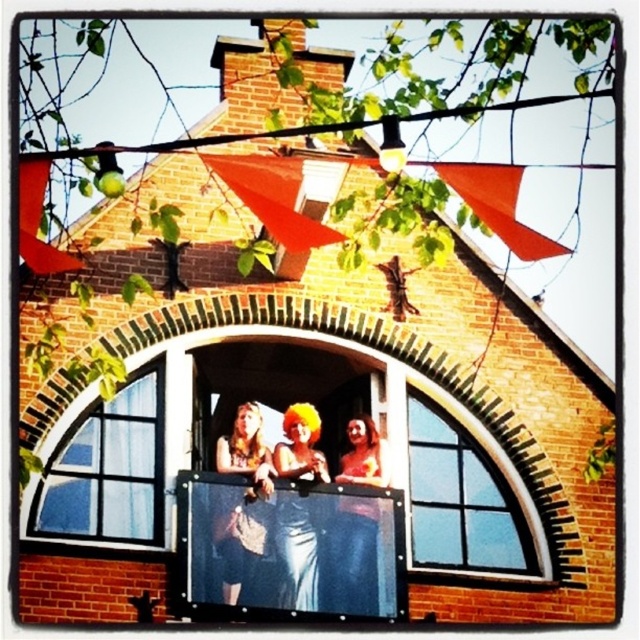
Question: Is matte blue jeans at center in front of orange wig at center?

Choices:
 (A) yes
 (B) no

Answer: (B)

Question: Can you confirm if clear glass window at center is bigger than denim skirt at center?

Choices:
 (A) yes
 (B) no

Answer: (A)

Question: Among these points, which one is nearest to the camera?

Choices:
 (A) (291, 497)
 (B) (157, 513)
 (C) (477, 524)
 (D) (240, 436)

Answer: (B)

Question: Which point appears closest to the camera in this image?

Choices:
 (A) (128, 413)
 (B) (534, 564)

Answer: (A)

Question: Does clear glass window at lower left have a greater width compared to denim skirt at center?

Choices:
 (A) yes
 (B) no

Answer: (B)

Question: Which object appears closest to the camera in this image?

Choices:
 (A) clear glass window at center
 (B) clear glass window at lower left

Answer: (B)